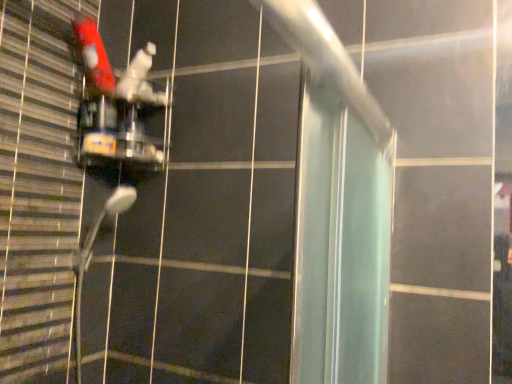
What do you see at coordinates (93, 55) in the screenshot? I see `matte plastic toothbrush at upper left` at bounding box center [93, 55].

The width and height of the screenshot is (512, 384). Identify the location of matte plastic toothbrush at upper left. (93, 55).

Locate an element on the screen. This screenshot has width=512, height=384. matte plastic toothbrush at upper left is located at coordinates (x=93, y=55).